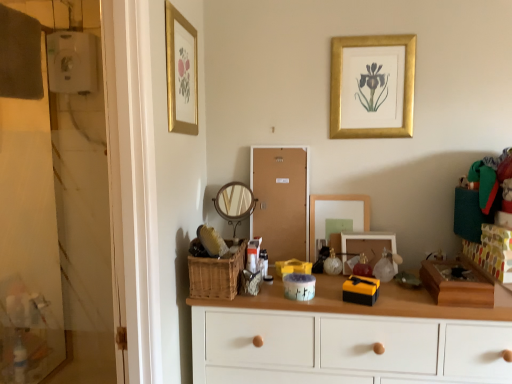
Where is `vacant point to the right of shiny metallic toy at center`? vacant point to the right of shiny metallic toy at center is located at coordinates (407, 284).